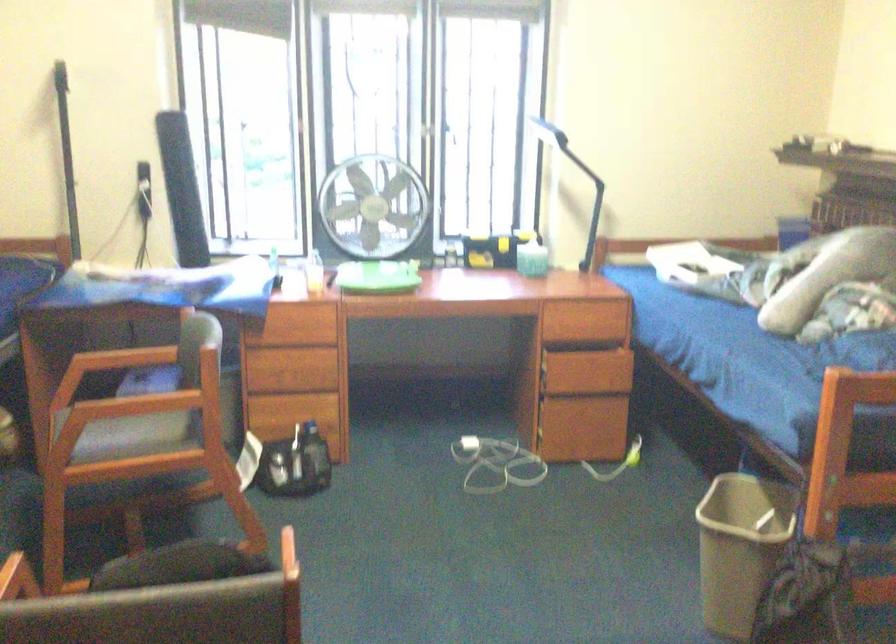
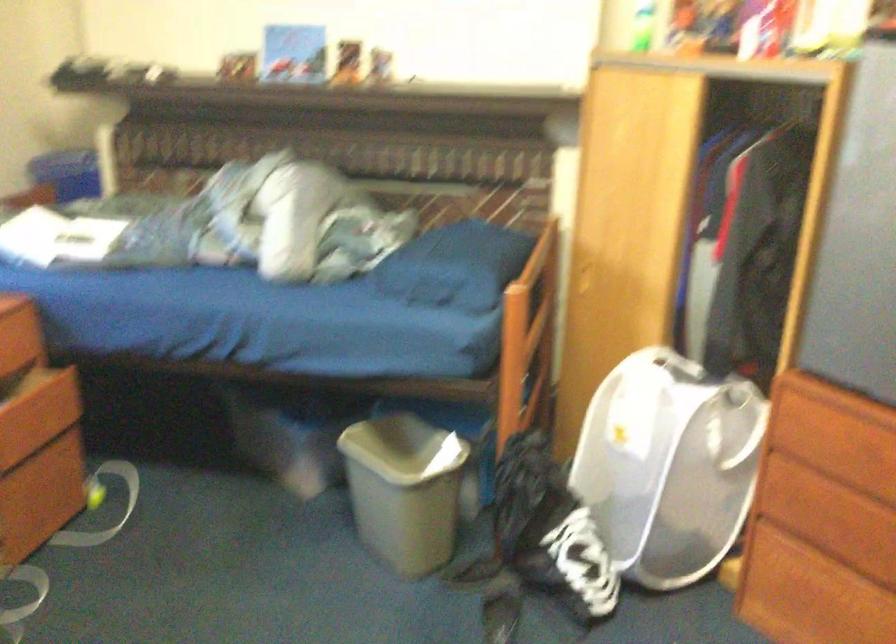
The point at [593,371] is marked in the first image. Where is the corresponding point in the second image?

(39, 413)